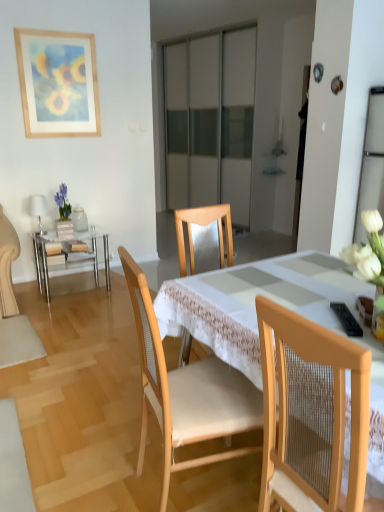
Question: Which direction should I rotate to look at wooden chair at center, acting as the 1th chair starting from the left?

Choices:
 (A) right
 (B) left

Answer: (A)

Question: From the image's perspective, is clear glass table at left over black plastic remote control at lower right?

Choices:
 (A) no
 (B) yes

Answer: (B)

Question: Is black plastic remote control at lower right at the back of clear glass table at left?

Choices:
 (A) yes
 (B) no

Answer: (B)

Question: Is clear glass table at left not near black plastic remote control at lower right?

Choices:
 (A) yes
 (B) no

Answer: (A)

Question: Does clear glass table at left have a larger size compared to black plastic remote control at lower right?

Choices:
 (A) yes
 (B) no

Answer: (A)

Question: Is clear glass table at left in contact with black plastic remote control at lower right?

Choices:
 (A) yes
 (B) no

Answer: (B)

Question: From a real-world perspective, is clear glass table at left below black plastic remote control at lower right?

Choices:
 (A) yes
 (B) no

Answer: (A)

Question: Are wooden table at center and black plastic remote control at lower right making contact?

Choices:
 (A) no
 (B) yes

Answer: (A)

Question: Can you confirm if wooden table at center is wider than black plastic remote control at lower right?

Choices:
 (A) yes
 (B) no

Answer: (A)

Question: Is black plastic remote control at lower right completely or partially inside wooden table at center?

Choices:
 (A) yes
 (B) no

Answer: (A)

Question: From a real-world perspective, is wooden table at center under black plastic remote control at lower right?

Choices:
 (A) yes
 (B) no

Answer: (A)

Question: Could you tell me if wooden table at center is facing black plastic remote control at lower right?

Choices:
 (A) yes
 (B) no

Answer: (B)

Question: From the image's perspective, does wooden table at center appear higher than black plastic remote control at lower right?

Choices:
 (A) yes
 (B) no

Answer: (B)

Question: From the image's perspective, is black plastic remote control at lower right beneath wooden chair at center, acting as the 1th chair starting from the left?

Choices:
 (A) no
 (B) yes

Answer: (A)